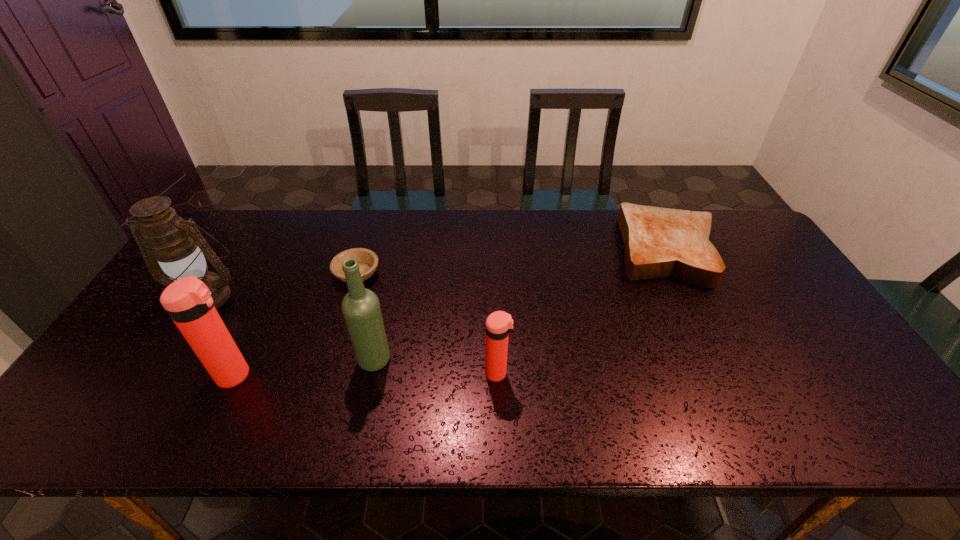
Locate an element on the screen. vacant area between the rightmost object and the leftmost object is located at coordinates point(437,273).

Where is `free space between the fifth object from left to right and the bowl`? Image resolution: width=960 pixels, height=540 pixels. free space between the fifth object from left to right and the bowl is located at coordinates (427, 323).

Find the location of `free space between the wine bottle and the taller thermos bottle`. free space between the wine bottle and the taller thermos bottle is located at coordinates (305, 368).

Choose which object is the nearest neighbor to the rightmost object. Please provide its 2D coordinates. Your answer should be formatted as a tuple, i.e. [(x, y)], where the tuple contains the x and y coordinates of a point satisfying the conditions above.

[(499, 324)]

Identify which object is the third closest to the taller thermos bottle. Please provide its 2D coordinates. Your answer should be formatted as a tuple, i.e. [(x, y)], where the tuple contains the x and y coordinates of a point satisfying the conditions above.

[(368, 261)]

At what (x,y) coordinates should I click in order to perform the action: click on free space that satisfies the following two spatial constraints: 1. on the back side of the leftmost object; 2. on the left side of the bread. Please return your answer as a coordinate pair (x, y). The width and height of the screenshot is (960, 540). Looking at the image, I should click on (234, 250).

At what (x,y) coordinates should I click in order to perform the action: click on vacant space that satisfies the following two spatial constraints: 1. on the back side of the rightmost object; 2. on the right side of the shortest object. Please return your answer as a coordinate pair (x, y). Looking at the image, I should click on (364, 250).

What are the coordinates of `blank area in the image that satisfies the following two spatial constraints: 1. on the front side of the bowl; 2. on the right side of the wine bottle` in the screenshot? It's located at [x=331, y=360].